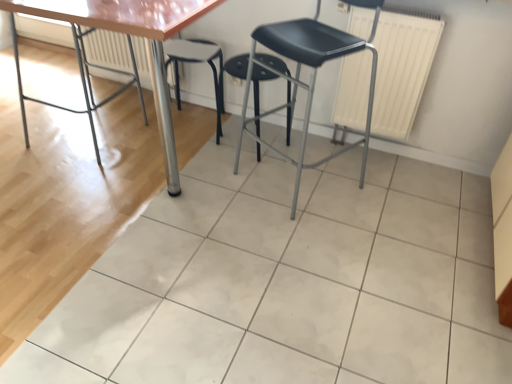
This screenshot has height=384, width=512. I want to click on vacant space in front of metallic polished table at left, so click(70, 183).